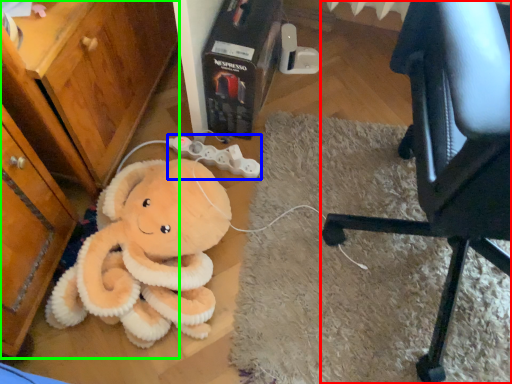
Question: Which is nearer to the chair (highlighted by a red box)? game controller (highlighted by a blue box) or dresser (highlighted by a green box).

Choices:
 (A) game controller
 (B) dresser

Answer: (A)